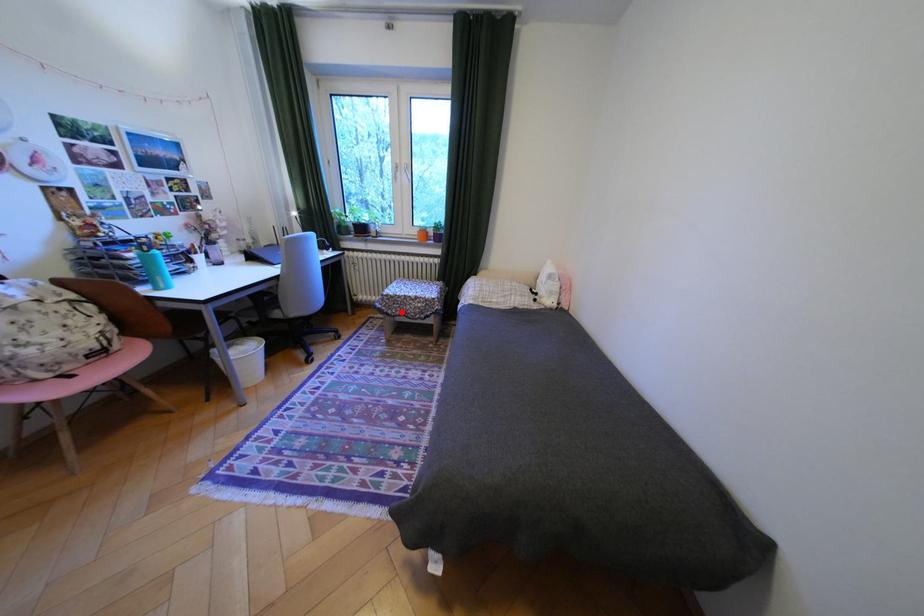
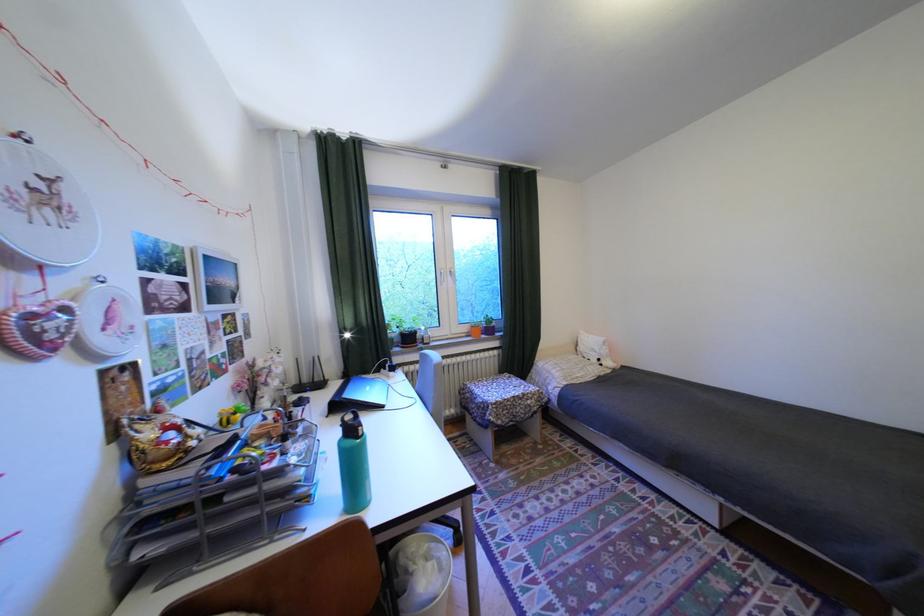
Question: I am providing you with two images of the same scene from different viewpoints. In image1, a red point is highlighted. Considering the same 3D point in image2, which of the following is correct?

Choices:
 (A) It is closer
 (B) It is farther

Answer: (B)